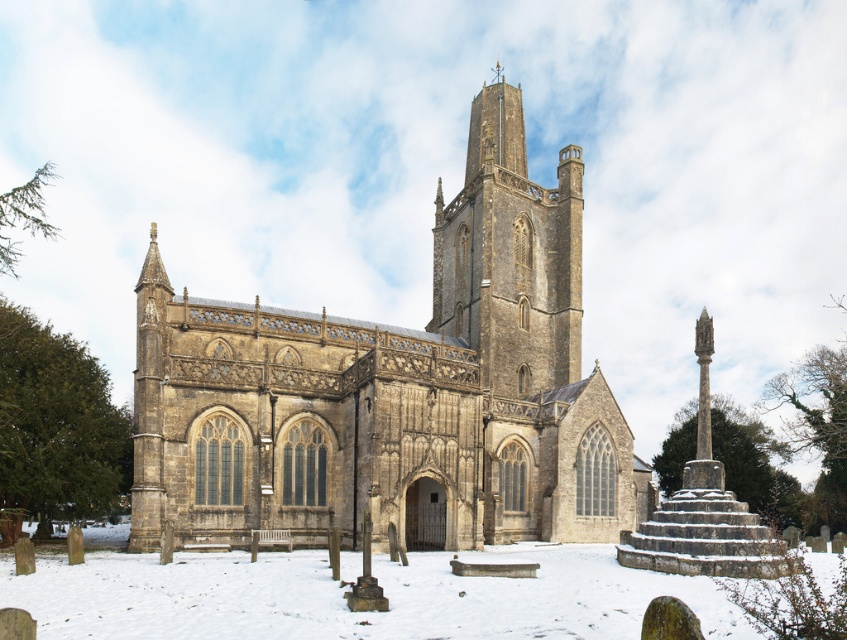
Question: Which object is the closest to the stone church at center?

Choices:
 (A) white powdery snow at center
 (B) brown stone tower at center

Answer: (B)

Question: Observing the image, what is the correct spatial positioning of white powdery snow at center in reference to brown stone tower at center?

Choices:
 (A) above
 (B) below

Answer: (B)

Question: Can you confirm if white powdery snow at center is positioned to the right of brown stone tower at center?

Choices:
 (A) no
 (B) yes

Answer: (A)

Question: Which of the following is the closest to the observer?

Choices:
 (A) (479, 260)
 (B) (306, 401)

Answer: (B)

Question: Which point appears farthest from the camera in this image?

Choices:
 (A) (76, 616)
 (B) (443, 250)

Answer: (B)

Question: Is stone church at center thinner than white powdery snow at center?

Choices:
 (A) yes
 (B) no

Answer: (A)